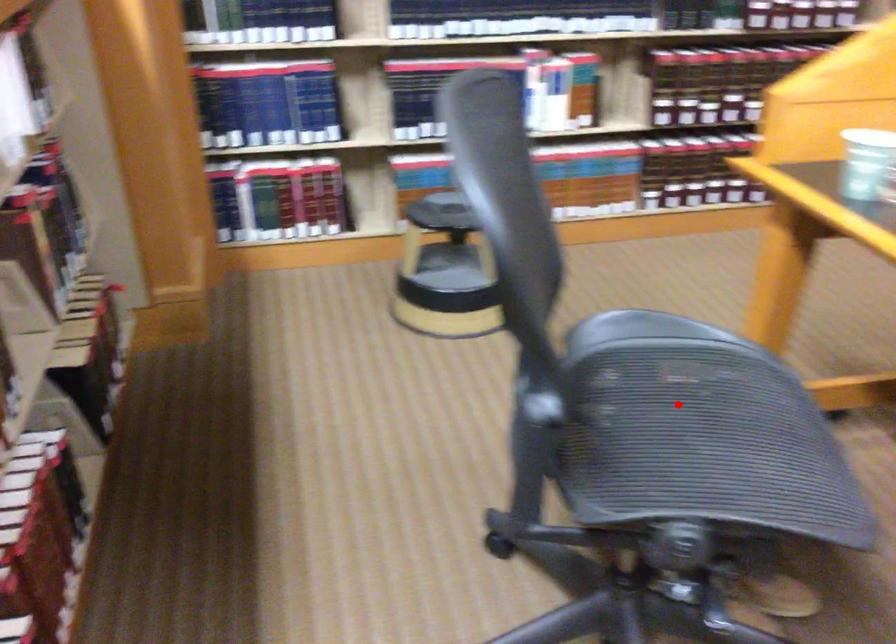
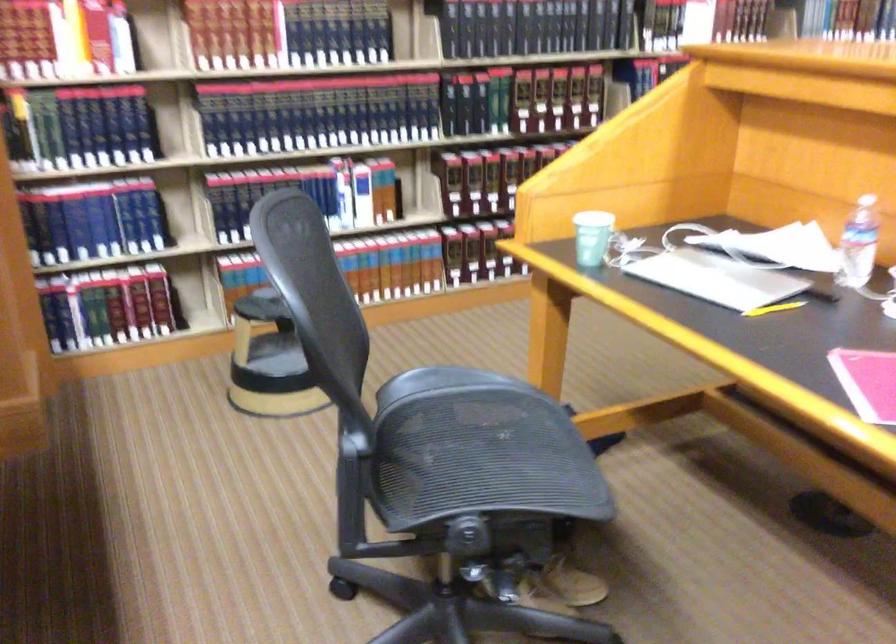
Question: I am providing you with two images of the same scene from different viewpoints. Image1 has a red point marked. In image2, the corresponding 3D location appears at what relative position? Reply with the corresponding letter.

Choices:
 (A) Closer
 (B) Farther

Answer: (B)